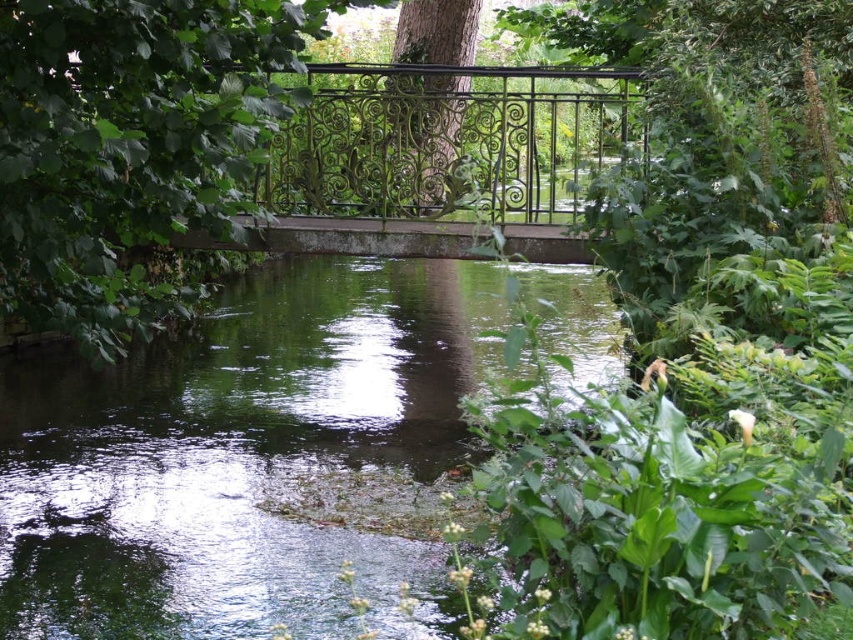
You are a gardener who wants to prune the plants along the stream. You notice the green leafy plant at center and the green matte tree at center. Which one should you prune first if you need to start with the larger one?

The green leafy plant at center is bigger than the green matte tree at center, so you should prune the green leafy plant at center first.

You are standing at the edge of the stream and see two points marked in the scene. The first point is at coordinate point (729,452) and the second is at point (300,113). Which point is closer to you?

Point (729,452) is in front of point (300,113), so it is closer to you.

You are standing on the bank of the stream and want to cross to the other side. The green wrought iron railing at center and the green matte tree at center are in your path. Which object is closer to you as you approach the stream?

The green wrought iron railing at center is closer to you because it is positioned above the green matte tree at center, meaning it is situated higher up and therefore more accessible as you approach the stream.